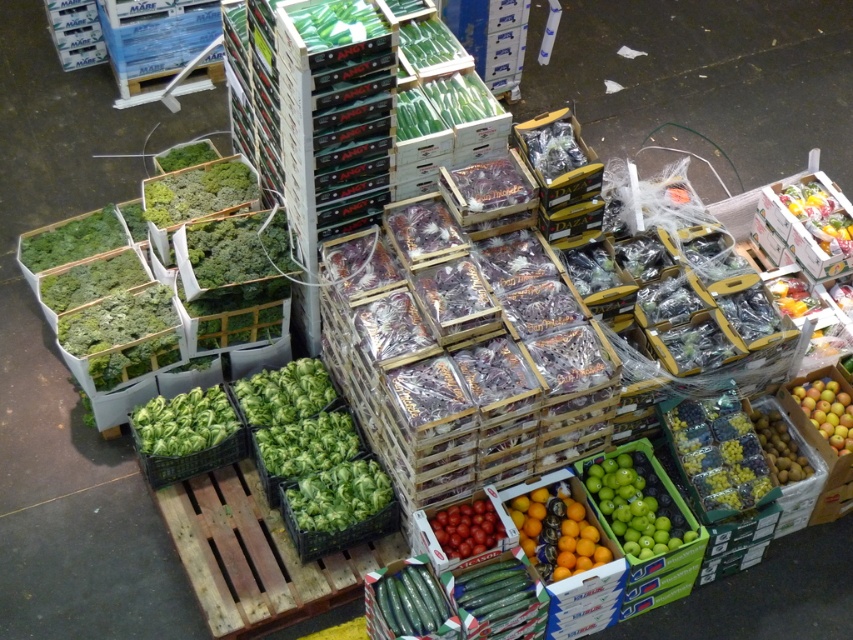
Question: Is green leafy lettuce at center to the left of green matte beans at center from the viewer's perspective?

Choices:
 (A) no
 (B) yes

Answer: (B)

Question: Which point is farther from the camera taking this photo?

Choices:
 (A) (476, 524)
 (B) (601, 547)

Answer: (B)

Question: Does glossy orange at center appear on the left side of green leafy lettuce at center?

Choices:
 (A) yes
 (B) no

Answer: (B)

Question: Which point is closer to the camera?

Choices:
 (A) (488, 545)
 (B) (70, 228)
 (C) (834, 241)
 (D) (660, 468)

Answer: (A)

Question: Which of the following is the farthest from the observer?

Choices:
 (A) green leafy at center
 (B) green matte grapes at lower right
 (C) glossy orange at center
 (D) green matte apples at center-right

Answer: (A)

Question: From the image, what is the correct spatial relationship of green glossy beans at upper center in relation to green matte grapes at lower right?

Choices:
 (A) left
 (B) right

Answer: (A)